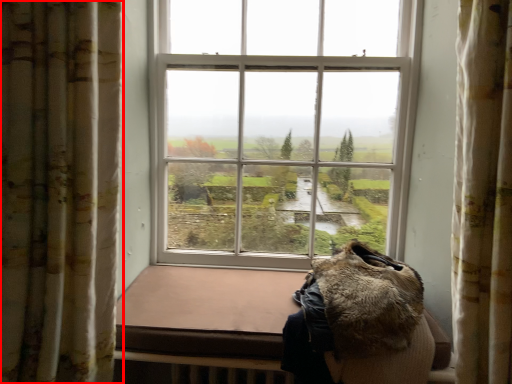
Question: Considering the relative positions of curtain (annotated by the red box) and animal in the image provided, where is curtain (annotated by the red box) located with respect to the staircase?

Choices:
 (A) left
 (B) right

Answer: (A)